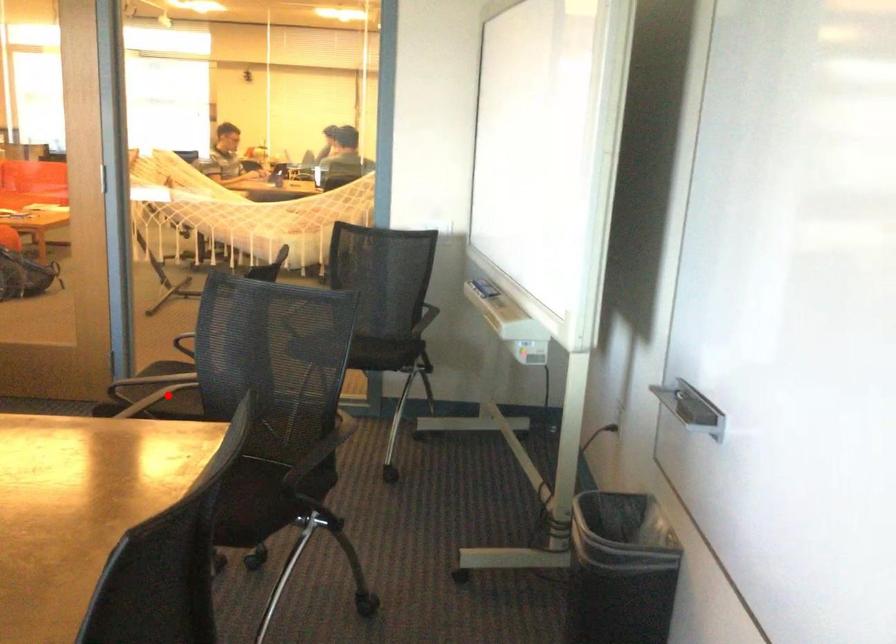
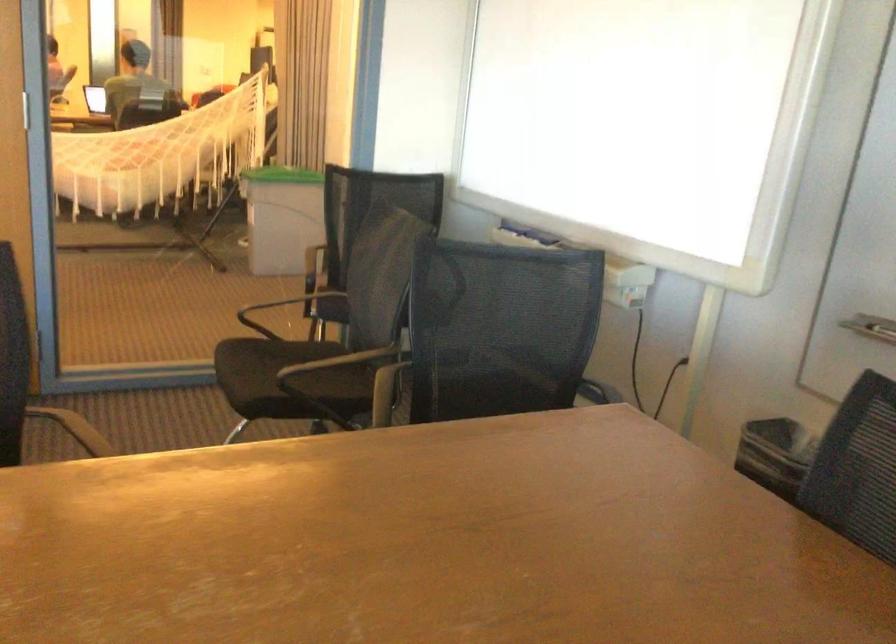
Question: I am providing you with two images of the same scene from different viewpoints. Given a red point in image1, look at the same physical point in image2. Is it:

Choices:
 (A) Closer to the viewpoint
 (B) Farther from the viewpoint

Answer: (A)